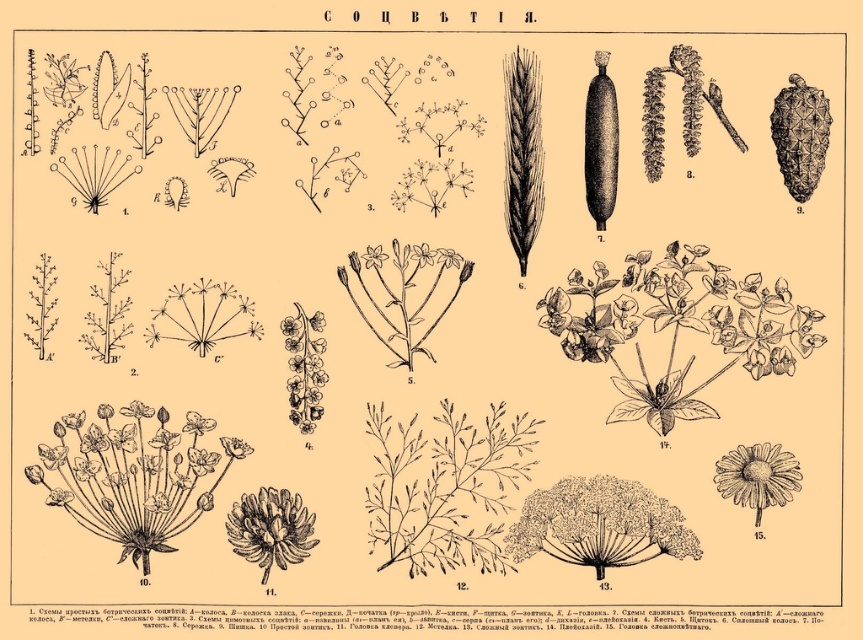
Does smooth green leaves at center appear on the left side of brown textured flower at center?

No, smooth green leaves at center is not to the left of brown textured flower at center.

Does smooth green leaves at center appear over brown textured flower at center?

Yes, smooth green leaves at center is above brown textured flower at center.

Between point (684, 260) and point (291, 504), which one is positioned in front?

Positioned in front is point (291, 504).

Identify the location of smooth green leaves at center. (684, 314).

Does white fluffy flower at center have a lesser height compared to brown textured flower at center?

In fact, white fluffy flower at center may be taller than brown textured flower at center.

Which is more to the right, white fluffy flower at center or brown textured flower at center?

From the viewer's perspective, white fluffy flower at center appears more on the right side.

Does point (520, 524) lie in front of point (262, 504)?

No, it is not.

Locate an element on the screen. The width and height of the screenshot is (863, 640). white fluffy flower at center is located at coordinates (599, 524).

Which is below, smooth green leaves at center or white fluffy flower at center?

Positioned lower is white fluffy flower at center.

Measure the distance between smooth green leaves at center and camera.

6.77 feet

Is point (619, 310) less distant than point (618, 560)?

That is False.

Locate an element on the screen. smooth green leaves at center is located at coordinates (684, 314).